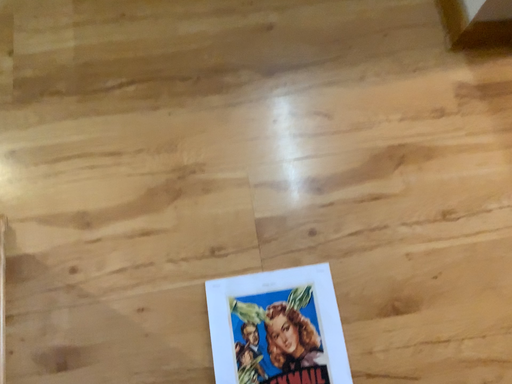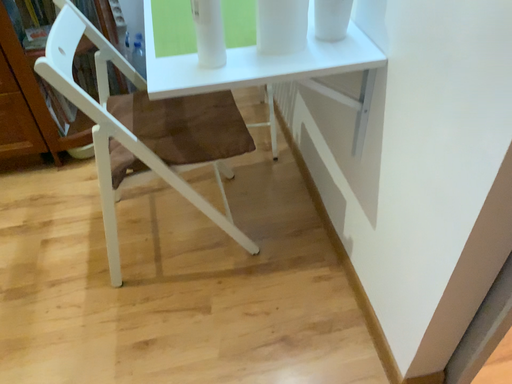
Question: Which way did the camera rotate in the video?

Choices:
 (A) rotated downward
 (B) rotated upward

Answer: (B)